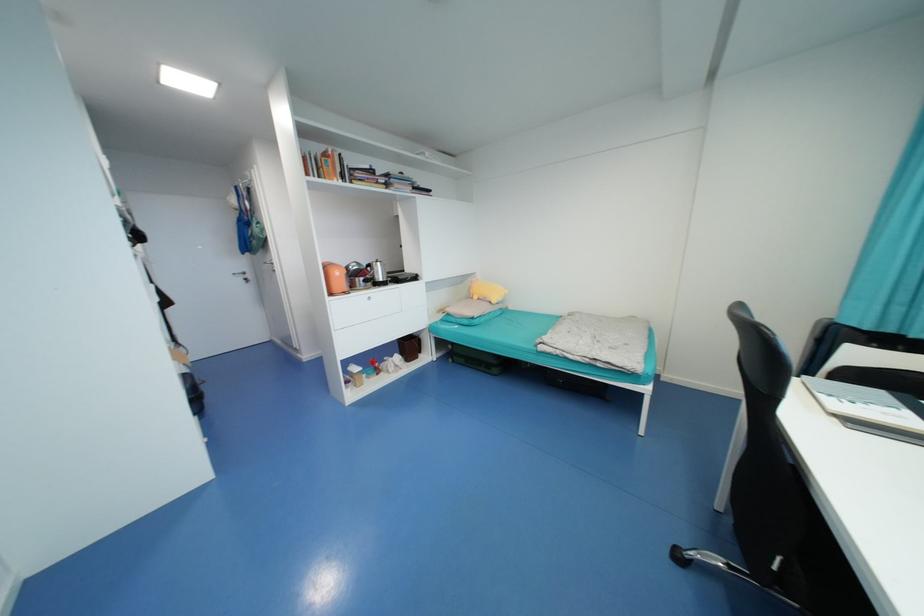
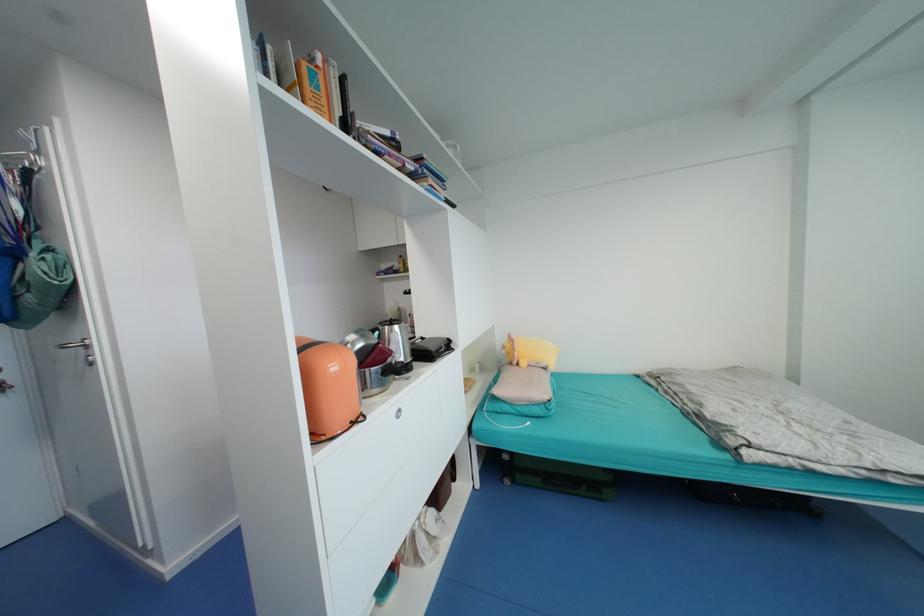
Find the pixel in the second image that matches the point at 480,299 in the first image.

(529, 365)